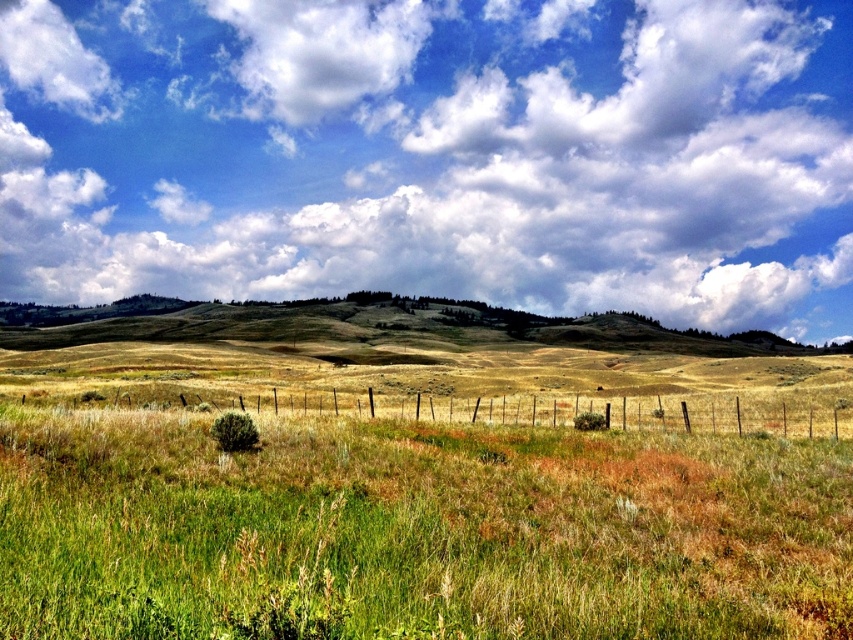
Does white fluffy cloud at upper center appear on the right side of green grassy field at center?

In fact, white fluffy cloud at upper center is to the left of green grassy field at center.

Does white fluffy cloud at upper center come behind green grassy field at center?

Yes.

Measure the distance between point (440, 268) and camera.

The distance of point (440, 268) from camera is 532.53 meters.

Where is `white fluffy cloud at upper center`? The image size is (853, 640). white fluffy cloud at upper center is located at coordinates (434, 154).

Which of these two, green grassy field at center or brown wire fence at center, stands taller?

brown wire fence at center is taller.

In the scene shown: Is the position of green grassy field at center more distant than that of brown wire fence at center?

No, green grassy field at center is in front of brown wire fence at center.

Does point (146, 512) lie behind point (775, 424)?

No, (146, 512) is in front of (775, 424).

Where is `green grassy field at center`? The height and width of the screenshot is (640, 853). green grassy field at center is located at coordinates (416, 531).

Image resolution: width=853 pixels, height=640 pixels. Describe the element at coordinates (434, 154) in the screenshot. I see `white fluffy cloud at upper center` at that location.

Is white fluffy cloud at upper center smaller than brown wire fence at center?

No.

This screenshot has height=640, width=853. Describe the element at coordinates (434, 154) in the screenshot. I see `white fluffy cloud at upper center` at that location.

The height and width of the screenshot is (640, 853). I want to click on white fluffy cloud at upper center, so click(x=434, y=154).